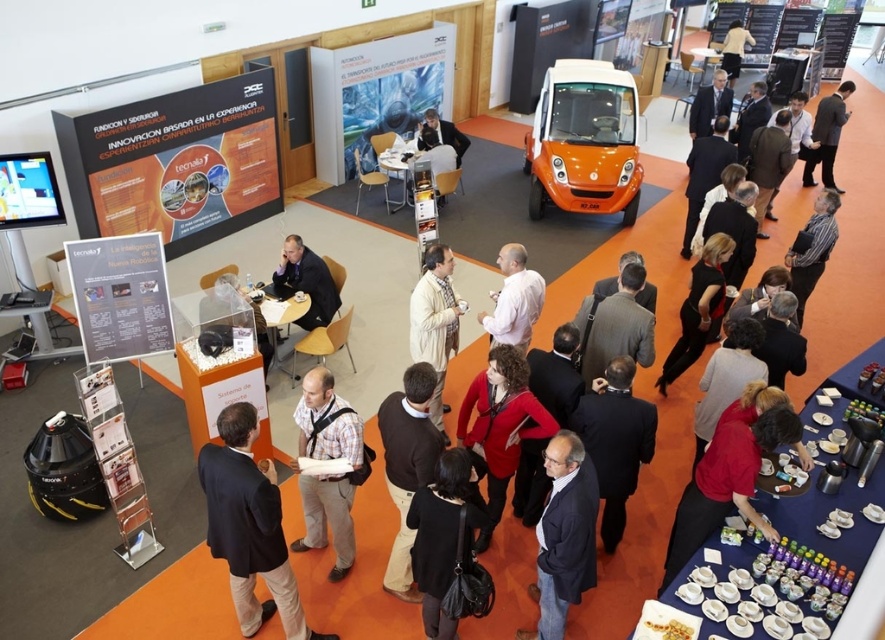
You are an event organizer at the exhibition and need to arrange two items on a table. You have a dark blue fabric coat at lower center and a black leather jacket at lower right. Which item should you place on the left side of the table to match their current positions?

The dark blue fabric coat at lower center should be placed on the left side of the table since it is currently positioned on the left side of the black leather jacket at lower right.

You are organizing a photo shoot and need to choose between the red matte jacket at center and the matte black suit at center for a model. Which item would you select if you want the clothing to stand out more against the orange floor?

The red matte jacket at center would stand out more against the orange floor because its color contrasts more with the orange background compared to the matte black suit at center.

You are at the point labeled point (427, 506) and want to walk towards the exit located at point (729, 83). However, there are several people and tables between you and the exit. Can you directly see the exit from your current position?

Since point (427, 506) is in front of point (729, 83), you are closer to the exit and can directly see it without obstruction.